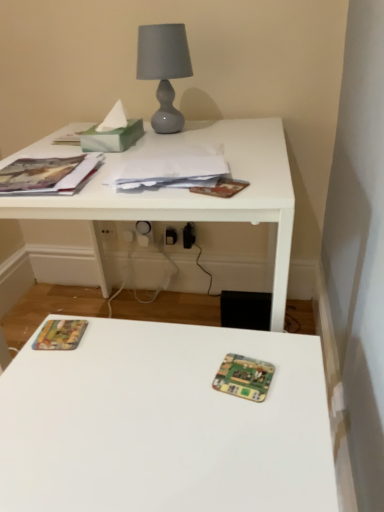
Question: Looking at their shapes, would you say wooden printed card game at center is wider or thinner than white paper at center?

Choices:
 (A) wide
 (B) thin

Answer: (B)

Question: From a real-world perspective, is wooden printed card game at center physically located above or below white paper at center?

Choices:
 (A) above
 (B) below

Answer: (B)

Question: Considering the real-world distances, which object is farthest from the matte gray glass table lamp at upper center?

Choices:
 (A) white paper at center
 (B) white plastic electric outlet at center
 (C) multicolored paper at lower left, the 2th paperback book when ordered from top to bottom
 (D) white glossy table at upper center
 (E) green marbled tissue at upper left

Answer: (C)

Question: Which object is positioned farthest from the white plastic electric outlet at center?

Choices:
 (A) white glossy table at upper center
 (B) white paper at center
 (C) green marbled tissue at upper left
 (D) matte gray glass table lamp at upper center
 (E) multicolored paper at lower left, the 2th paperback book when ordered from top to bottom

Answer: (E)